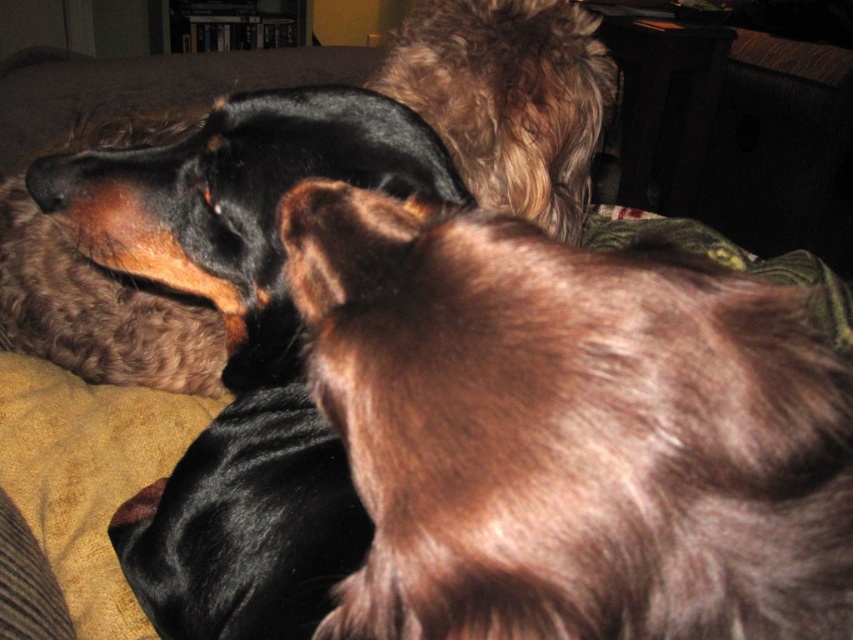
From the picture: You are trying to decide which dog to pet first. The shiny black coat at upper left and the fuzzy brown dog at upper center are both present. Based on their positions, which dog is more to the left?

The shiny black coat at upper left is more to the left because it is positioned on the left side of the fuzzy brown dog at upper center.

You are standing in the living room and want to place a small decorative item exactly at the coordinates where the shiny black coat at upper left is located. What is the coordinate point you should aim for?

The coordinate point you should aim for is (242,348).

You are a dog owner who wants to buy a new blanket for your dogs. The blanket needs to cover both the shiny black coat at upper left and the fuzzy brown dog at upper center. Based on their sizes, which dog requires a larger blanket?

The shiny black coat at upper left requires a larger blanket because it is bigger than the fuzzy brown dog at upper center.